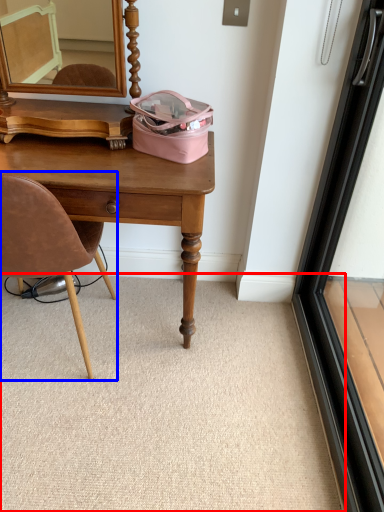
Question: Among these objects, which one is nearest to the camera, plain (highlighted by a red box) or chair (highlighted by a blue box)?

Choices:
 (A) plain
 (B) chair

Answer: (B)